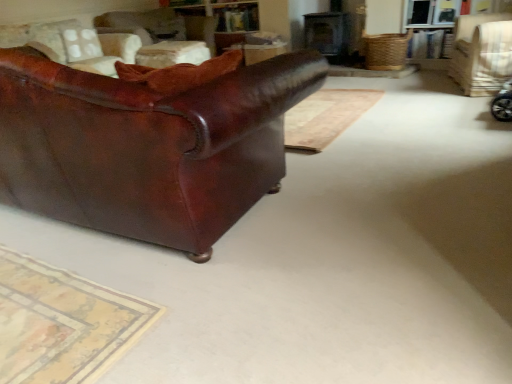
Question: Is leather couch at left, which appears as the first chair when viewed from the left, placed right next to shiny brown leather couch at left?

Choices:
 (A) yes
 (B) no

Answer: (B)

Question: Is leather couch at left, which appears as the first chair when viewed from the left, wider than shiny brown leather couch at left?

Choices:
 (A) no
 (B) yes

Answer: (A)

Question: Is leather couch at left, the 3th chair when ordered from right to left, not within shiny brown leather couch at left?

Choices:
 (A) no
 (B) yes

Answer: (B)

Question: Is shiny brown leather couch at left at the back of leather couch at left, the 3th chair when ordered from right to left?

Choices:
 (A) yes
 (B) no

Answer: (B)

Question: Does leather couch at left, which appears as the first chair when viewed from the left, have a smaller size compared to shiny brown leather couch at left?

Choices:
 (A) yes
 (B) no

Answer: (A)

Question: Considering the positions of leather couch at upper left, the second chair positioned from the right, and leather couch at left, which appears as the first chair when viewed from the left, in the image, is leather couch at upper left, the second chair positioned from the right, bigger or smaller than leather couch at left, which appears as the first chair when viewed from the left,?

Choices:
 (A) big
 (B) small

Answer: (B)

Question: From the image's perspective, relative to leather couch at left, the 3th chair when ordered from right to left, is leather couch at upper left, which is the second chair from left to right, above or below?

Choices:
 (A) above
 (B) below

Answer: (A)

Question: Does point (160, 31) appear closer or farther from the camera than point (34, 41)?

Choices:
 (A) farther
 (B) closer

Answer: (A)

Question: In the image, is leather couch at upper left, which is the second chair from left to right, positioned in front of or behind leather couch at left, which appears as the first chair when viewed from the left?

Choices:
 (A) front
 (B) behind

Answer: (B)

Question: Which is correct: wooden table at center is inside shiny brown leather couch at left, or outside of it?

Choices:
 (A) outside
 (B) inside

Answer: (A)

Question: Does point (176, 44) appear closer or farther from the camera than point (41, 97)?

Choices:
 (A) closer
 (B) farther

Answer: (B)

Question: Is wooden table at center wider or thinner than shiny brown leather couch at left?

Choices:
 (A) wide
 (B) thin

Answer: (B)

Question: Relative to shiny brown leather couch at left, is wooden table at center in front or behind?

Choices:
 (A) behind
 (B) front

Answer: (A)

Question: Considering their positions, is leather couch at upper left, which is the second chair from left to right, located in front of or behind light beige fabric chair at upper right, which is the 1th chair in right-to-left order?

Choices:
 (A) behind
 (B) front

Answer: (A)

Question: From a real-world perspective, is leather couch at upper left, which is the second chair from left to right, above or below light beige fabric chair at upper right, which is the 1th chair in right-to-left order?

Choices:
 (A) above
 (B) below

Answer: (A)